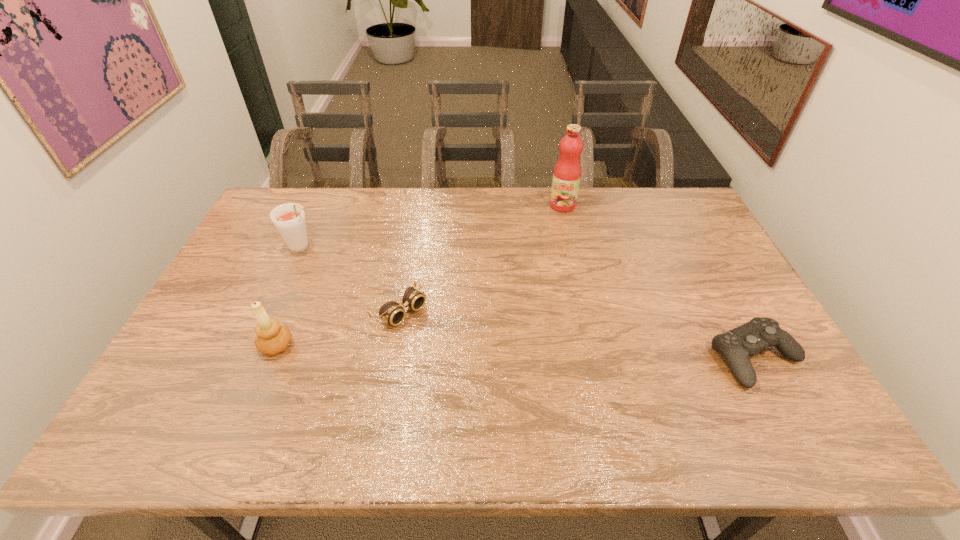
This screenshot has height=540, width=960. I want to click on blank space located on the front label of the fruit juice, so click(533, 253).

Where is `vacant area situated 0.140m on the front label of the fruit juice`? vacant area situated 0.140m on the front label of the fruit juice is located at coordinates (545, 234).

Locate an element on the screen. vacant space located on the front label of the fruit juice is located at coordinates (542, 238).

The height and width of the screenshot is (540, 960). I want to click on free space located on the drink side of the fourth nearest object, so click(x=381, y=300).

Locate an element on the screen. The height and width of the screenshot is (540, 960). vacant region located on the drink side of the fourth nearest object is located at coordinates (377, 297).

Locate an element on the screen. vacant region located on the drink side of the fourth nearest object is located at coordinates (341, 271).

Where is `free location located 0.050m through the lenses of the goggles`? This screenshot has height=540, width=960. free location located 0.050m through the lenses of the goggles is located at coordinates (430, 334).

Find the location of a particular element. The image size is (960, 540). vacant space positioned through the lenses of the goggles is located at coordinates [x=488, y=381].

The width and height of the screenshot is (960, 540). I want to click on free space located through the lenses of the goggles, so click(x=448, y=349).

This screenshot has height=540, width=960. Identify the location of object that is at the far edge. (567, 172).